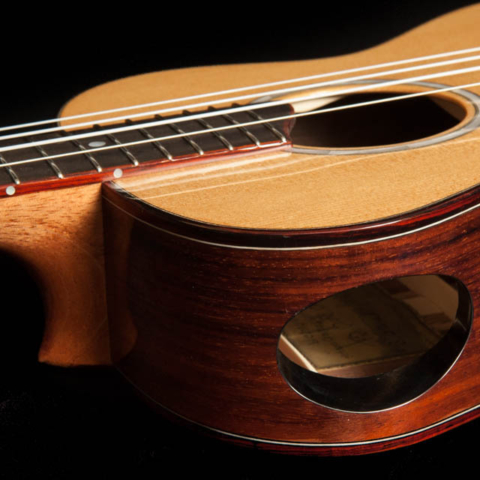
Where is `light wood`? This screenshot has width=480, height=480. light wood is located at coordinates point(366,193).